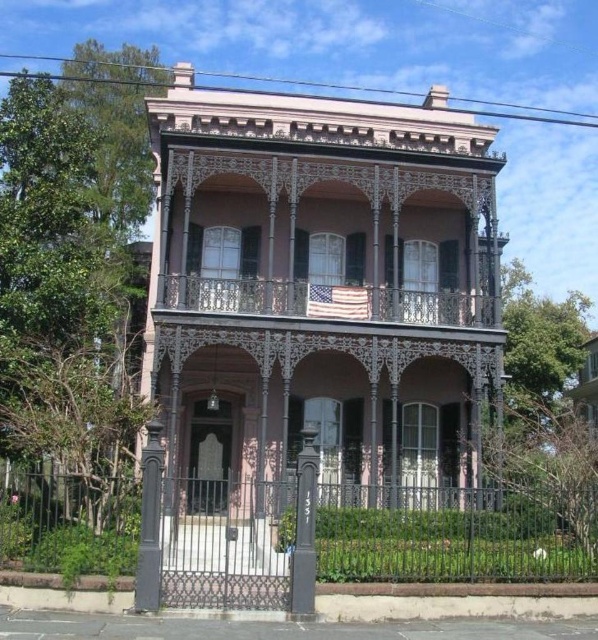
Question: Which point is farther to the camera?

Choices:
 (A) black wrought iron gate at center
 (B) black polished metal post at center

Answer: (A)

Question: Does black wrought iron gate at center have a greater width compared to black wrought iron post at lower left?

Choices:
 (A) no
 (B) yes

Answer: (B)

Question: Among these points, which one is farthest from the camera?

Choices:
 (A) (152, 528)
 (B) (299, 465)
 (C) (7, 500)

Answer: (C)

Question: Can you confirm if black wrought iron gate at center is positioned above black wrought iron post at lower left?

Choices:
 (A) no
 (B) yes

Answer: (A)

Question: Which object is positioned farthest from the black wrought iron gate at center?

Choices:
 (A) black polished metal post at center
 (B) black wrought iron post at lower left

Answer: (B)

Question: In this image, where is black wrought iron gate at center located relative to black polished metal post at center?

Choices:
 (A) right
 (B) left

Answer: (B)